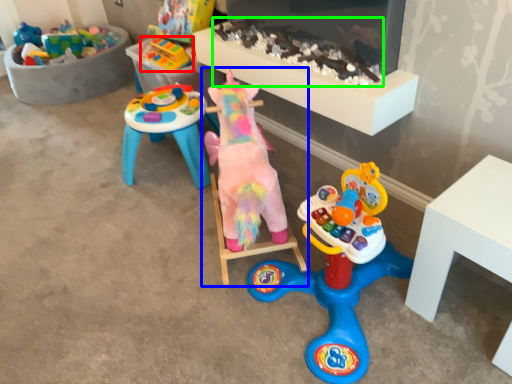
Question: Which object is positioned farthest from toy (highlighted by a red box)? Select from toy (highlighted by a blue box) and toy (highlighted by a green box).

Choices:
 (A) toy
 (B) toy

Answer: (A)